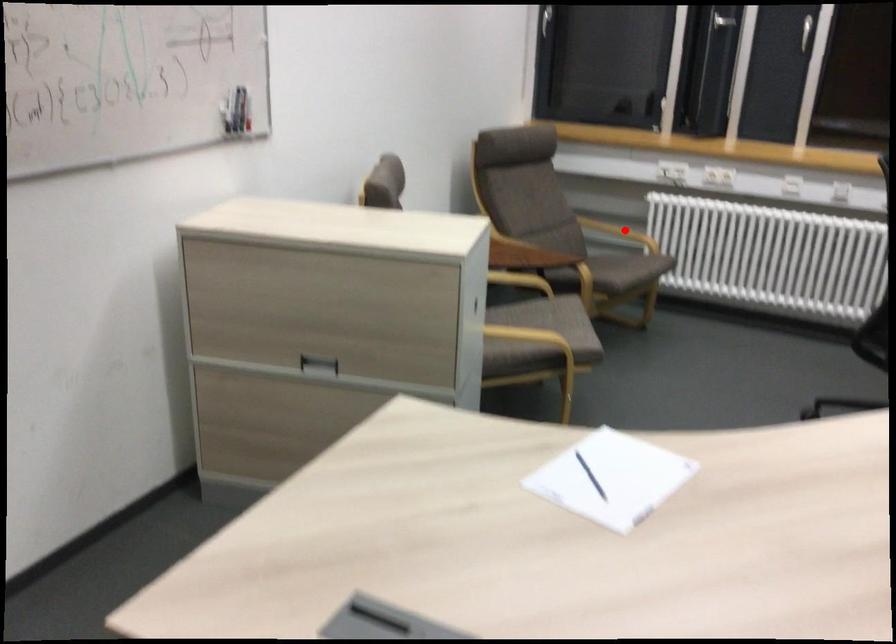
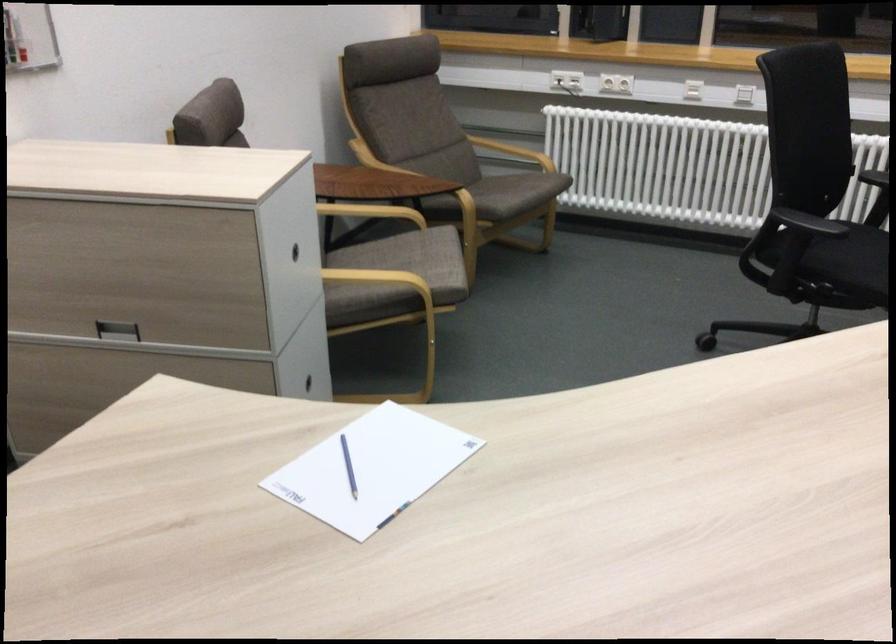
Where in the second image is the point corresponding to the highlighted location from the first image?

(512, 152)